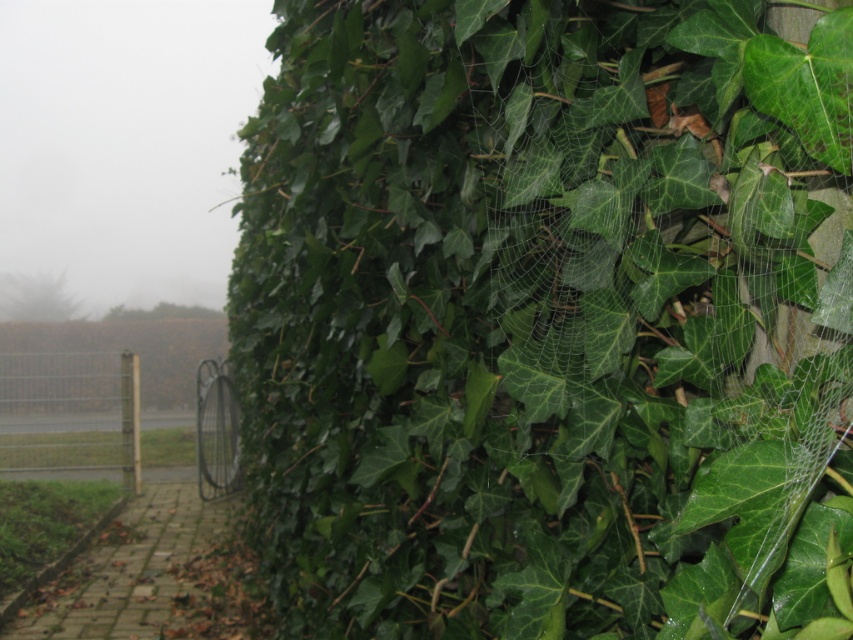
Question: Which point is closer to the camera?

Choices:
 (A) green leafy spider web at upper right
 (B) metallic wire fence at left

Answer: (A)

Question: Can you confirm if green leafy spider web at upper right is positioned to the left of metallic wire fence at left?

Choices:
 (A) yes
 (B) no

Answer: (B)

Question: Is green leafy spider web at upper right thinner than metallic wire fence at left?

Choices:
 (A) no
 (B) yes

Answer: (B)

Question: Is green leafy spider web at upper right above metallic wire fence at left?

Choices:
 (A) no
 (B) yes

Answer: (B)